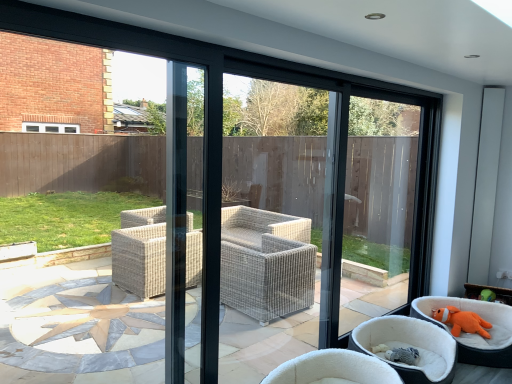
Question: Is orange plush toy at lower right, which is the 2th chair from left to right, at the back of orange plush toy at lower right?

Choices:
 (A) yes
 (B) no

Answer: (B)

Question: Does orange plush toy at lower right have a greater height compared to orange plush toy at lower right, which is the 2th chair from left to right?

Choices:
 (A) no
 (B) yes

Answer: (A)

Question: Would you say orange plush toy at lower right contains orange plush toy at lower right, which is the 2th chair in right-to-left order?

Choices:
 (A) no
 (B) yes

Answer: (A)

Question: From the image's perspective, is orange plush toy at lower right on orange plush toy at lower right, which is the 2th chair in right-to-left order?

Choices:
 (A) yes
 (B) no

Answer: (A)

Question: Is orange plush toy at lower right at the left side of orange plush toy at lower right, which is the 2th chair in right-to-left order?

Choices:
 (A) no
 (B) yes

Answer: (A)

Question: In terms of height, does white wicker chair at center, the first chair from the left, look taller or shorter compared to orange plush toy at lower right?

Choices:
 (A) short
 (B) tall

Answer: (B)

Question: Is white wicker chair at center, the third chair when ordered from right to left, spatially inside orange plush toy at lower right, or outside of it?

Choices:
 (A) inside
 (B) outside

Answer: (B)

Question: Is white wicker chair at center, the third chair when ordered from right to left, in front of or behind orange plush toy at lower right in the image?

Choices:
 (A) behind
 (B) front

Answer: (B)

Question: From a real-world perspective, relative to orange plush toy at lower right, is white wicker chair at center, the third chair when ordered from right to left, vertically above or below?

Choices:
 (A) below
 (B) above

Answer: (A)

Question: From a real-world perspective, is orange plush toy at lower right above or below orange plush toy at lower right, the third chair positioned from the left?

Choices:
 (A) below
 (B) above

Answer: (A)

Question: Visually, is orange plush toy at lower right positioned to the left or to the right of orange plush toy at lower right, the third chair positioned from the left?

Choices:
 (A) right
 (B) left

Answer: (A)

Question: Based on their sizes in the image, would you say orange plush toy at lower right is bigger or smaller than orange plush toy at lower right, placed as the first chair when sorted from right to left?

Choices:
 (A) small
 (B) big

Answer: (A)

Question: Is point (488, 334) closer or farther from the camera than point (461, 357)?

Choices:
 (A) farther
 (B) closer

Answer: (A)

Question: Looking at the image, does orange plush toy at lower right seem bigger or smaller compared to orange plush toy at lower right, which is the 2th chair from left to right?

Choices:
 (A) big
 (B) small

Answer: (B)

Question: Considering the positions of orange plush toy at lower right and orange plush toy at lower right, which is the 2th chair in right-to-left order, in the image, is orange plush toy at lower right wider or thinner than orange plush toy at lower right, which is the 2th chair in right-to-left order,?

Choices:
 (A) wide
 (B) thin

Answer: (B)